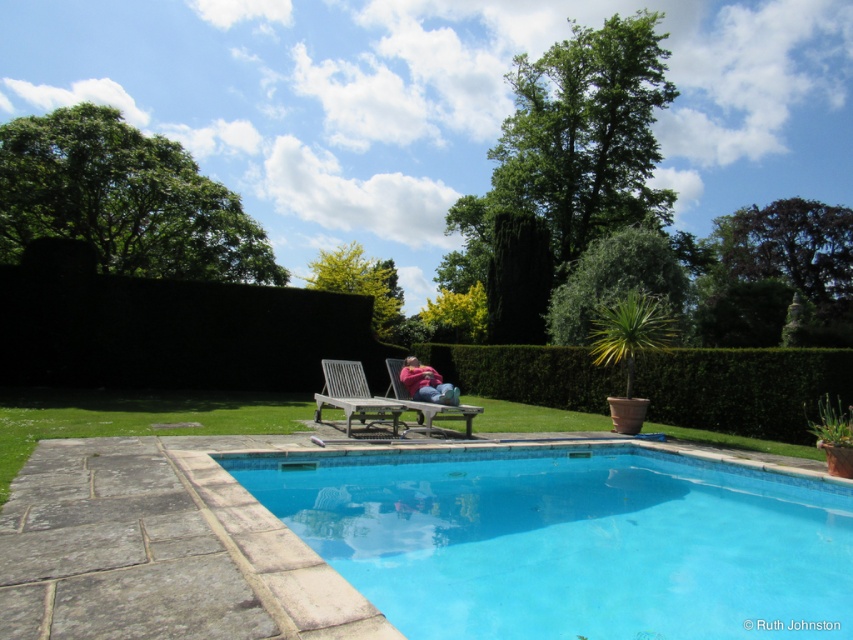
You are standing at the edge of the blue tile swimming pool at center and want to reach the wooden slats lounge chair at center. Which direction should you walk to get there?

Since the blue tile swimming pool at center is in front of the wooden slats lounge chair at center, you should walk backward to reach the wooden slats lounge chair at center.